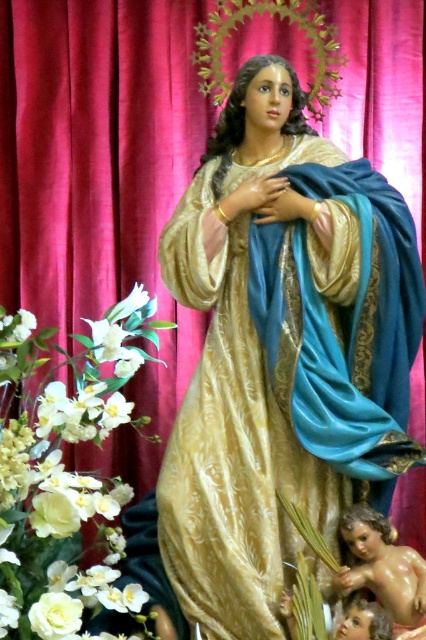
Can you confirm if gold satin robe at center is wider than smooth beige baby at lower right?

Yes.

Can you confirm if gold satin robe at center is positioned to the left of smooth beige baby at lower right?

Indeed, gold satin robe at center is positioned on the left side of smooth beige baby at lower right.

Does point (351, 186) come closer to viewer compared to point (379, 529)?

No, (351, 186) is behind (379, 529).

Locate an element on the screen. The width and height of the screenshot is (426, 640). gold satin robe at center is located at coordinates (284, 378).

Between white silk flowers at left and white silk flower at center, which one is positioned lower?

white silk flowers at left

Does white silk flowers at left appear on the right side of white silk flower at center?

No, white silk flowers at left is not to the right of white silk flower at center.

Who is more forward, (111, 424) or (144, 296)?

Point (111, 424) is more forward.

The height and width of the screenshot is (640, 426). What are the coordinates of `white silk flowers at left` in the screenshot? It's located at (63, 476).

Is gold satin robe at center below white silk flower at center?

Yes.

Is gold satin robe at center to the right of white silk flower at center from the viewer's perspective?

Indeed, gold satin robe at center is positioned on the right side of white silk flower at center.

The height and width of the screenshot is (640, 426). Describe the element at coordinates (284, 378) in the screenshot. I see `gold satin robe at center` at that location.

This screenshot has width=426, height=640. In order to click on gold satin robe at center in this screenshot , I will do `click(284, 378)`.